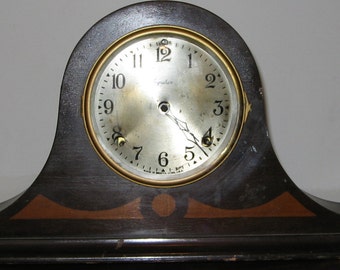
At what (x,y) coordinates should I click in order to perform the action: click on clock face. Please return your answer as a coordinate pair (x, y). This screenshot has width=340, height=270. Looking at the image, I should click on (142, 117).